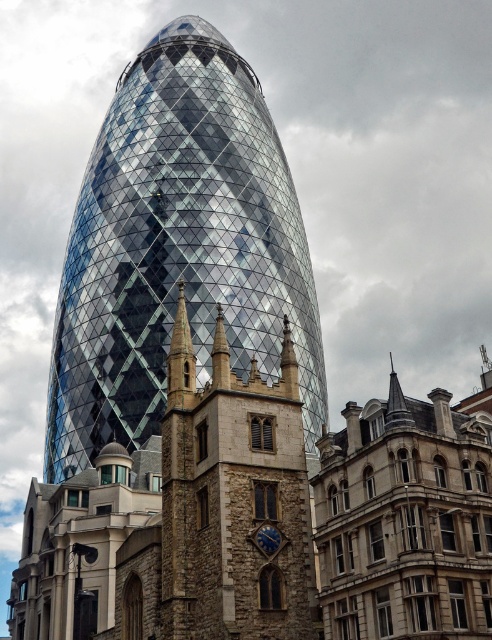
Question: Which point is farther from the camera taking this photo?

Choices:
 (A) (228, 435)
 (B) (245, 252)

Answer: (B)

Question: Is geometric glass tower at center to the left of stone clock tower at center from the viewer's perspective?

Choices:
 (A) no
 (B) yes

Answer: (B)

Question: Is geometric glass tower at center thinner than stone clock tower at center?

Choices:
 (A) no
 (B) yes

Answer: (A)

Question: Can you confirm if geometric glass tower at center is bigger than stone clock tower at center?

Choices:
 (A) no
 (B) yes

Answer: (B)